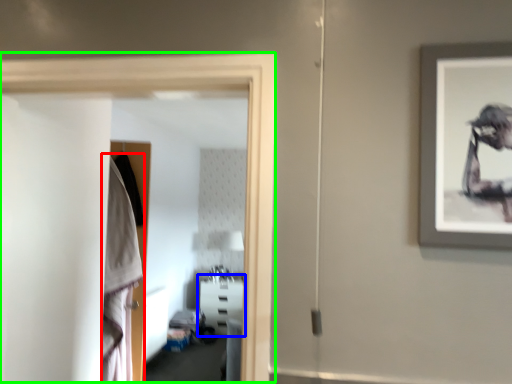
Question: Which is farther away from robe (highlighted by a red box)? furniture (highlighted by a blue box) or glass door (highlighted by a green box)?

Choices:
 (A) furniture
 (B) glass door

Answer: (A)